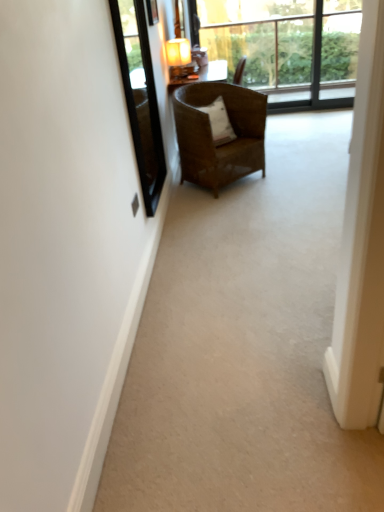
Where is `transparent glass window screen at upper left`? This screenshot has height=512, width=384. transparent glass window screen at upper left is located at coordinates (140, 96).

Where is `white glossy screen door at right`? white glossy screen door at right is located at coordinates (362, 246).

What do you see at coordinates (362, 246) in the screenshot? I see `white glossy screen door at right` at bounding box center [362, 246].

What do you see at coordinates (286, 47) in the screenshot? I see `transparent glass window at upper center` at bounding box center [286, 47].

Image resolution: width=384 pixels, height=512 pixels. What do you see at coordinates (211, 134) in the screenshot?
I see `brown woven chair at center` at bounding box center [211, 134].

Describe the element at coordinates (179, 58) in the screenshot. I see `matte brown lamp at upper center` at that location.

Find the location of `transparent glass window screen at upper left`. transparent glass window screen at upper left is located at coordinates (140, 96).

Is transparent glass window screen at upper left next to white glossy screen door at right and touching it?

transparent glass window screen at upper left is not next to white glossy screen door at right, and they're not touching.

Is transparent glass window screen at upper left outside of white glossy screen door at right?

Yes, transparent glass window screen at upper left is outside of white glossy screen door at right.

Which object is thinner, transparent glass window screen at upper left or white glossy screen door at right?

With smaller width is transparent glass window screen at upper left.

Can you confirm if transparent glass window screen at upper left is bigger than white glossy screen door at right?

Actually, transparent glass window screen at upper left might be smaller than white glossy screen door at right.

How many degrees apart are the facing directions of brown woven chair at center and white soft pillow at center?

brown woven chair at center and white soft pillow at center are facing 0.000448 degrees away from each other.

From the image's perspective, does brown woven chair at center appear higher than white soft pillow at center?

No, from the image's perspective, brown woven chair at center is not above white soft pillow at center.

Considering the sizes of objects brown woven chair at center and white soft pillow at center in the image provided, who is bigger, brown woven chair at center or white soft pillow at center?

Bigger between the two is brown woven chair at center.

Is brown woven chair at center not close to white soft pillow at center?

brown woven chair at center is actually quite close to white soft pillow at center.

Is matte brown lamp at upper center looking in the opposite direction of transparent glass window screen at upper left?

matte brown lamp at upper center is not turned away from transparent glass window screen at upper left.

Is matte brown lamp at upper center inside the boundaries of transparent glass window screen at upper left, or outside?

matte brown lamp at upper center cannot be found inside transparent glass window screen at upper left.

Is point (177, 76) closer or farther from the camera than point (156, 129)?

Point (177, 76).

Does transparent glass window at upper center have a greater height compared to matte brown lamp at upper center?

Yes, transparent glass window at upper center is taller than matte brown lamp at upper center.

In the scene shown: Can we say transparent glass window at upper center lies outside matte brown lamp at upper center?

Yes, transparent glass window at upper center is outside of matte brown lamp at upper center.

Who is more distant, transparent glass window at upper center or matte brown lamp at upper center?

transparent glass window at upper center is further away from the camera.

In the scene shown: Does brown woven chair at center come behind matte brown lamp at upper center?

That is False.

Can we say brown woven chair at center lies outside matte brown lamp at upper center?

Absolutely, brown woven chair at center is external to matte brown lamp at upper center.

In the scene shown: Is brown woven chair at center smaller than matte brown lamp at upper center?

Actually, brown woven chair at center might be larger than matte brown lamp at upper center.

Considering the points (179, 147) and (170, 52), which point is behind, point (179, 147) or point (170, 52)?

The point (170, 52) is farther.

Is transparent glass window screen at upper left taller or shorter than brown woven chair at center?

In the image, transparent glass window screen at upper left appears to be taller than brown woven chair at center.

Who is more distant, transparent glass window screen at upper left or brown woven chair at center?

brown woven chair at center is further away from the camera.

Could you tell me if transparent glass window screen at upper left is facing brown woven chair at center?

No.

Considering the relative positions of transparent glass window screen at upper left and brown woven chair at center in the image provided, is transparent glass window screen at upper left to the right of brown woven chair at center from the viewer's perspective?

No, transparent glass window screen at upper left is not to the right of brown woven chair at center.

From the image's perspective, which one is positioned lower, transparent glass window at upper center or transparent glass window screen at upper left?

transparent glass window screen at upper left appears lower in the image.

Is point (199, 28) farther from viewer compared to point (142, 6)?

Yes, point (199, 28) is behind point (142, 6).

Which is correct: transparent glass window at upper center is inside transparent glass window screen at upper left, or outside of it?

transparent glass window at upper center is spatially situated outside transparent glass window screen at upper left.

At what (x,y) coordinates should I click in order to perform the action: click on screen door below the transparent glass window screen at upper left (from the image's perspective). Please return your answer as a coordinate pair (x, y). This screenshot has height=512, width=384. Looking at the image, I should click on (362, 246).

Where is `chair on the right of white soft pillow at center`? Image resolution: width=384 pixels, height=512 pixels. chair on the right of white soft pillow at center is located at coordinates (211, 134).

Based on their spatial positions, is white glossy screen door at right or white soft pillow at center closer to transparent glass window at upper center?

white soft pillow at center is positioned closer to the anchor transparent glass window at upper center.

Based on their spatial positions, is white soft pillow at center or brown woven chair at center further from white glossy screen door at right?

The object further to white glossy screen door at right is white soft pillow at center.

Based on the photo, which object lies nearer to the anchor point matte brown lamp at upper center, white glossy screen door at right or white soft pillow at center?

Based on the image, white soft pillow at center appears to be nearer to matte brown lamp at upper center.

Considering their positions, is transparent glass window at upper center positioned closer to transparent glass window screen at upper left than brown woven chair at center?

brown woven chair at center.

When comparing their distances from transparent glass window screen at upper left, does brown woven chair at center or transparent glass window at upper center seem closer?

brown woven chair at center.

Which object lies further to the anchor point white glossy screen door at right, white soft pillow at center or transparent glass window at upper center?

transparent glass window at upper center is positioned further to the anchor white glossy screen door at right.

Considering their positions, is white soft pillow at center positioned closer to transparent glass window screen at upper left than transparent glass window at upper center?

white soft pillow at center is positioned closer to the anchor transparent glass window screen at upper left.

Looking at the image, which one is located further to white soft pillow at center, matte brown lamp at upper center or transparent glass window at upper center?

transparent glass window at upper center is further to white soft pillow at center.

Where is `chair between transparent glass window screen at upper left and matte brown lamp at upper center in the front-back direction`? The width and height of the screenshot is (384, 512). chair between transparent glass window screen at upper left and matte brown lamp at upper center in the front-back direction is located at coordinates (211, 134).

What are the coordinates of `lamp between white glossy screen door at right and transparent glass window at upper center in the front-back direction` in the screenshot? It's located at (179, 58).

Where is `window screen between white glossy screen door at right and matte brown lamp at upper center along the z-axis`? This screenshot has width=384, height=512. window screen between white glossy screen door at right and matte brown lamp at upper center along the z-axis is located at coordinates (140, 96).

The width and height of the screenshot is (384, 512). I want to click on pillow between brown woven chair at center and transparent glass window at upper center along the z-axis, so click(x=219, y=122).